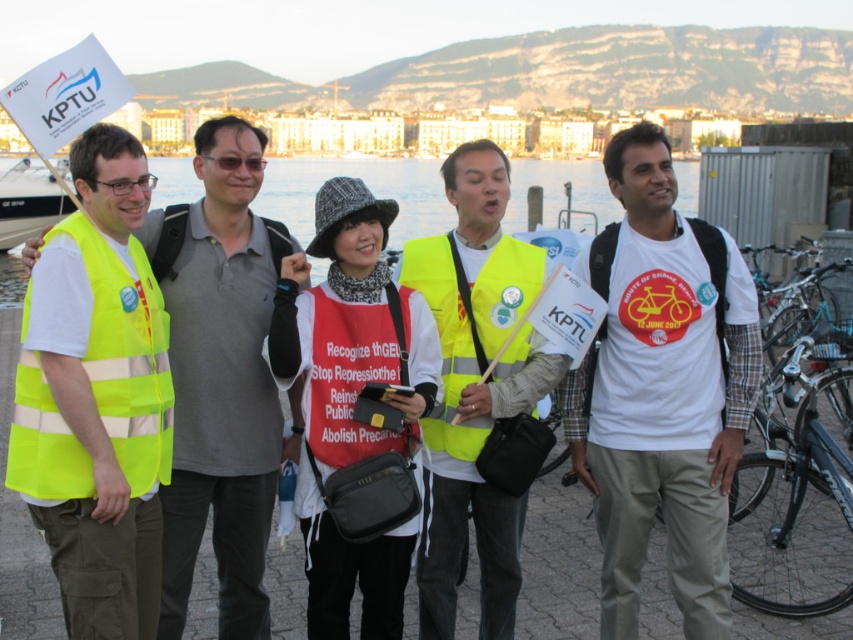
Question: Which of the following is the closest to the observer?

Choices:
 (A) (32, 252)
 (B) (57, 195)

Answer: (A)

Question: Does neon yellow reflective safety vest at left lie in front of black plastic goggles at center?

Choices:
 (A) yes
 (B) no

Answer: (A)

Question: Considering the relative positions of white plastic boat at left and matte black glasses at left in the image provided, where is white plastic boat at left located with respect to matte black glasses at left?

Choices:
 (A) right
 (B) left

Answer: (B)

Question: Which point is farther to the camera?

Choices:
 (A) neon yellow vest at left
 (B) yellow reflective vest at center
 (C) matte black glasses at left

Answer: (B)

Question: Where is white plastic boat at left located in relation to black plastic goggles at center in the image?

Choices:
 (A) below
 (B) above

Answer: (B)

Question: Which object is positioned farthest from the yellow reflective vest at center?

Choices:
 (A) white plastic boat at left
 (B) red matte safety vest at center

Answer: (B)